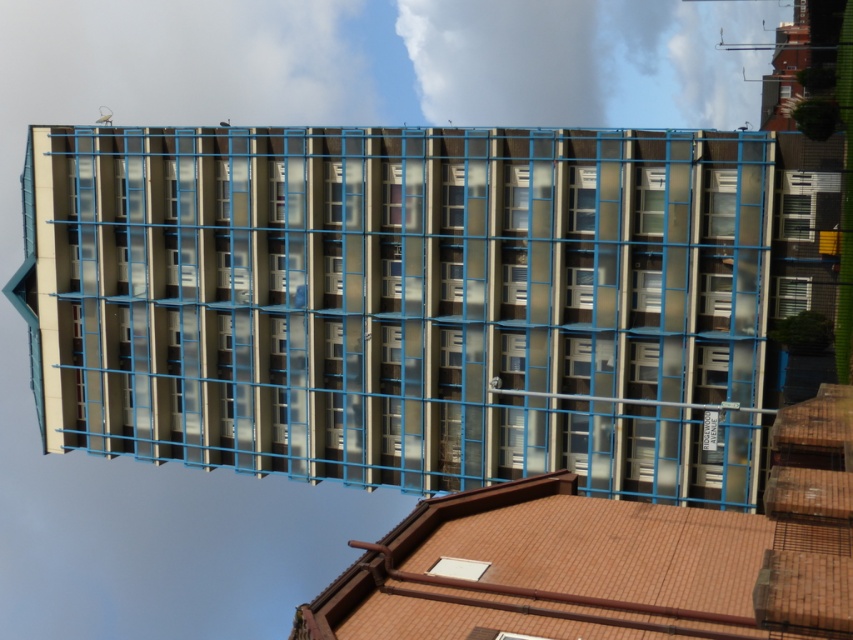
Question: Which point is farther to the camera?

Choices:
 (A) (802, 304)
 (B) (795, 225)

Answer: (A)

Question: Which point is farther to the camera?

Choices:
 (A) (808, 300)
 (B) (808, 234)

Answer: (A)

Question: Does clear glass window at right appear on the right side of white textured window at right?

Choices:
 (A) yes
 (B) no

Answer: (A)

Question: From the image, what is the correct spatial relationship of clear glass window at right in relation to white textured window at right?

Choices:
 (A) above
 (B) below

Answer: (A)

Question: Is clear glass window at right bigger than white textured window at right?

Choices:
 (A) yes
 (B) no

Answer: (B)

Question: Which point appears farthest from the camera in this image?

Choices:
 (A) (793, 300)
 (B) (790, 218)

Answer: (A)